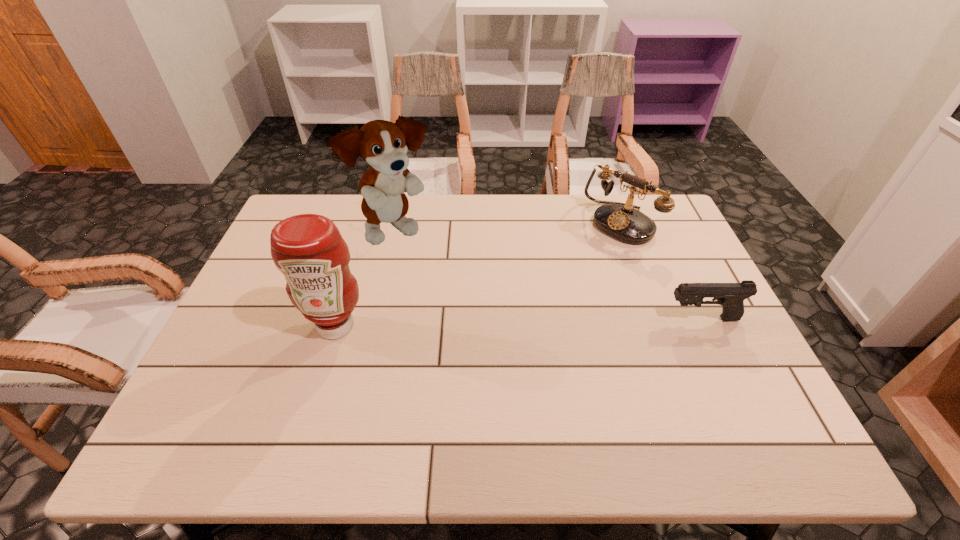
I want to click on free space on the desktop that is between the condiment and the pistol and is positioned on the face of the tallest object, so click(527, 322).

Find the location of a particular element. vacant spot on the desktop that is between the condiment and the pistol and is positioned on the dial of the telephone is located at coordinates (498, 323).